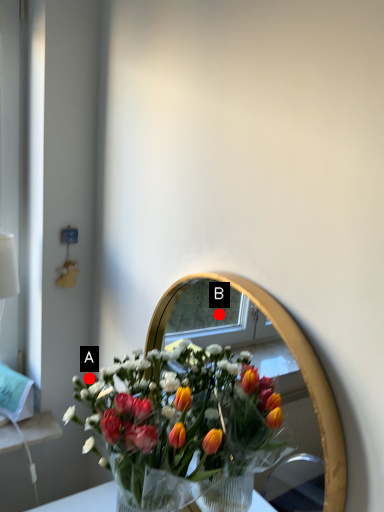
Question: Two points are circled on the image, labeled by A and B beside each circle. Which point is farther to the camera?

Choices:
 (A) A is further
 (B) B is further

Answer: (B)